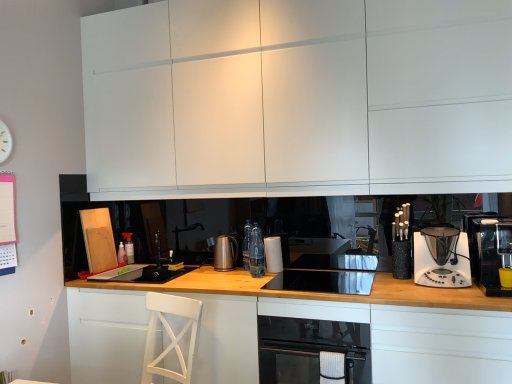
What do you see at coordinates (297, 98) in the screenshot?
I see `white matte cabinet at upper center, which is the first cabinetry in top-to-bottom order` at bounding box center [297, 98].

Locate an element on the screen. The height and width of the screenshot is (384, 512). white matte cabinet at upper center, which is the first cabinetry in top-to-bottom order is located at coordinates (297, 98).

Where is `black plastic coffee machine at right, which is the 3th kitchen appliance in left-to-right order`? The width and height of the screenshot is (512, 384). black plastic coffee machine at right, which is the 3th kitchen appliance in left-to-right order is located at coordinates (x=490, y=253).

Measure the distance between point (231, 268) and camera.

A distance of 2.86 meters exists between point (231, 268) and camera.

Identify the location of satin silver kettle at center, positioned as the 1th kitchen appliance in left-to-right order. (225, 253).

What is the approximate height of black glass oven at lower center?

black glass oven at lower center is 61.15 centimeters tall.

You are a GUI agent. You are given a task and a screenshot of the screen. Output one action in this format:
    pyautogui.click(x=<x>, y=<y>)
    Task: Click on the white matte cabinet at lower left, placed as the 2th cabinetry when sorted from bottom to top
    
    Given the screenshot: What is the action you would take?
    pyautogui.click(x=106, y=335)

In order to face white matte cabinet at lower left, positioned as the first cabinetry in bottom-to-top order, should I rotate leftwards or rightwards?

It's best to rotate right around 3.759 degrees.

This screenshot has height=384, width=512. In order to click on white matte cabinet at upper center, which is the first cabinetry in top-to-bottom order in this screenshot , I will do `click(297, 98)`.

Is white matte cabinet at lower left, which appears as the second cabinetry when viewed from the top, oriented towards satin silver kettle at center, which appears as the third kitchen appliance when viewed from the front?

No, white matte cabinet at lower left, which appears as the second cabinetry when viewed from the top, is not oriented towards satin silver kettle at center, which appears as the third kitchen appliance when viewed from the front.

In the scene shown: From a real-world perspective, which object stands above the other?

From a 3D spatial view, satin silver kettle at center, which appears as the third kitchen appliance when viewed from the front, is above.

From the image's perspective, is white matte cabinet at lower left, placed as the 2th cabinetry when sorted from bottom to top, above or below satin silver kettle at center, the first kitchen appliance positioned from the back?

white matte cabinet at lower left, placed as the 2th cabinetry when sorted from bottom to top, is below satin silver kettle at center, the first kitchen appliance positioned from the back.

Is satin silver kettle at center, positioned as the 1th kitchen appliance in left-to-right order, completely or partially inside white matte cabinet at lower left, which appears as the second cabinetry when viewed from the top?

No, satin silver kettle at center, positioned as the 1th kitchen appliance in left-to-right order, is not a part of white matte cabinet at lower left, which appears as the second cabinetry when viewed from the top.

From a real-world perspective, who is located higher, black glass oven at lower center or black plastic coffee machine at right, the 1th kitchen appliance from the front?

black plastic coffee machine at right, the 1th kitchen appliance from the front.

Considering their positions, is black glass oven at lower center located in front of or behind black plastic coffee machine at right, the 3th kitchen appliance when ordered from back to front?

black glass oven at lower center is positioned farther from the viewer than black plastic coffee machine at right, the 3th kitchen appliance when ordered from back to front.

Is black glass oven at lower center wider than black plastic coffee machine at right, the 3th kitchen appliance when ordered from back to front?

Indeed, black glass oven at lower center has a greater width compared to black plastic coffee machine at right, the 3th kitchen appliance when ordered from back to front.

Can you confirm if black glass oven at lower center is shorter than black plastic coffee machine at right, the 1th kitchen appliance from the front?

In fact, black glass oven at lower center may be taller than black plastic coffee machine at right, the 1th kitchen appliance from the front.

Between white plastic clock at upper left and black plastic coffee machine at right, which is the 3th kitchen appliance in left-to-right order, which one has less height?

With less height is white plastic clock at upper left.

Is white plastic clock at upper left facing away from black plastic coffee machine at right, which is the 3th kitchen appliance in left-to-right order?

That's not correct — white plastic clock at upper left is not looking away from black plastic coffee machine at right, which is the 3th kitchen appliance in left-to-right order.

Can you confirm if white plastic clock at upper left is thinner than black plastic coffee machine at right, the 1th kitchen appliance from the front?

Correct, the width of white plastic clock at upper left is less than that of black plastic coffee machine at right, the 1th kitchen appliance from the front.

Is white plastic clock at upper left beside black plastic coffee machine at right, the 3th kitchen appliance when ordered from back to front?

No, white plastic clock at upper left is not next to black plastic coffee machine at right, the 3th kitchen appliance when ordered from back to front.

Which of these two, black glass cooktop at center or white matte cabinet at lower left, which appears as the second cabinetry when viewed from the top, stands shorter?

black glass cooktop at center.

From the picture: How distant is black glass cooktop at center from white matte cabinet at lower left, placed as the 2th cabinetry when sorted from bottom to top?

black glass cooktop at center and white matte cabinet at lower left, placed as the 2th cabinetry when sorted from bottom to top, are 3.61 feet apart.

Is black glass cooktop at center outside of white matte cabinet at lower left, placed as the 2th cabinetry when sorted from bottom to top?

Absolutely, black glass cooktop at center is external to white matte cabinet at lower left, placed as the 2th cabinetry when sorted from bottom to top.

From the picture: Who is taller, black glass oven at lower center or white matte cabinet at lower left, the 3th cabinetry in the top-to-bottom sequence?

white matte cabinet at lower left, the 3th cabinetry in the top-to-bottom sequence, is taller.

The image size is (512, 384). Identify the location of home appliance above the white matte cabinet at lower left, the 3th cabinetry in the top-to-bottom sequence (from a real-world perspective). (311, 340).

How different are the orientations of black glass oven at lower center and white matte cabinet at lower left, positioned as the first cabinetry in bottom-to-top order, in degrees?

black glass oven at lower center and white matte cabinet at lower left, positioned as the first cabinetry in bottom-to-top order, are facing 3.88e-05 degrees away from each other.

Is black glass oven at lower center not within white matte cabinet at lower left, positioned as the first cabinetry in bottom-to-top order?

No, black glass oven at lower center is inside white matte cabinet at lower left, positioned as the first cabinetry in bottom-to-top order,'s boundary.

Would you say black glass oven at lower center is outside white plastic blender at right, acting as the 2th kitchen appliance starting from the right?

Yes, black glass oven at lower center is not within white plastic blender at right, acting as the 2th kitchen appliance starting from the right.

How different are the orientations of black glass oven at lower center and white plastic blender at right, acting as the 2th kitchen appliance starting from the right, in degrees?

They differ by 0.417 degrees in their facing directions.

Where is `home appliance below the white plastic blender at right, which is the second kitchen appliance from front to back (from a real-world perspective)`? This screenshot has height=384, width=512. home appliance below the white plastic blender at right, which is the second kitchen appliance from front to back (from a real-world perspective) is located at coordinates (311, 340).

Can you confirm if black glass oven at lower center is thinner than white plastic blender at right, the 2th kitchen appliance in the back-to-front sequence?

In fact, black glass oven at lower center might be wider than white plastic blender at right, the 2th kitchen appliance in the back-to-front sequence.

Which is in front, point (495, 230) or point (387, 328)?

The point (387, 328) is more forward.

From the image's perspective, does black plastic coffee machine at right, the 3th kitchen appliance when ordered from back to front, appear lower than white matte cabinet at lower left, positioned as the first cabinetry in bottom-to-top order?

Actually, black plastic coffee machine at right, the 3th kitchen appliance when ordered from back to front, appears above white matte cabinet at lower left, positioned as the first cabinetry in bottom-to-top order, in the image.

Can you confirm if black plastic coffee machine at right, which is the 3th kitchen appliance in left-to-right order, is wider than white matte cabinet at lower left, positioned as the first cabinetry in bottom-to-top order?

In fact, black plastic coffee machine at right, which is the 3th kitchen appliance in left-to-right order, might be narrower than white matte cabinet at lower left, positioned as the first cabinetry in bottom-to-top order.

From a real-world perspective, is black plastic coffee machine at right, which is the 3th kitchen appliance in left-to-right order, on top of white matte cabinet at lower left, positioned as the first cabinetry in bottom-to-top order?

Yes, from a real-world perspective, black plastic coffee machine at right, which is the 3th kitchen appliance in left-to-right order, is over white matte cabinet at lower left, positioned as the first cabinetry in bottom-to-top order

You are a GUI agent. You are given a task and a screenshot of the screen. Output one action in this format:
    pyautogui.click(x=<x>, y=<y>)
    Task: Click on the 3rd kitchen appliance behind the white matte cabinet at lower left, which appears as the second cabinetry when viewed from the top
    
    Given the screenshot: What is the action you would take?
    pyautogui.click(x=225, y=253)

Which kitchen appliance is the 2nd one when counting from the right side of the black glass oven at lower center? Please provide its 2D coordinates.

[(490, 253)]

When comparing their distances from black glass cooktop at center, does white plastic blender at right, acting as the 2th kitchen appliance starting from the right, or white matte cabinet at lower left, placed as the 2th cabinetry when sorted from bottom to top, seem closer?

white plastic blender at right, acting as the 2th kitchen appliance starting from the right.

Estimate the real-world distances between objects in this image. Which object is closer to satin silver kettle at center, the first kitchen appliance positioned from the back, black glass oven at lower center or white matte cabinet at lower left, which appears as the second cabinetry when viewed from the top?

white matte cabinet at lower left, which appears as the second cabinetry when viewed from the top, is closer to satin silver kettle at center, the first kitchen appliance positioned from the back.

When comparing their distances from white matte cabinet at lower left, positioned as the first cabinetry in bottom-to-top order, does black glass oven at lower center or black plastic coffee machine at right, which appears as the first kitchen appliance when viewed from the right, seem closer?

The object closer to white matte cabinet at lower left, positioned as the first cabinetry in bottom-to-top order, is black glass oven at lower center.

Estimate the real-world distances between objects in this image. Which object is closer to black plastic coffee machine at right, which is the 3th kitchen appliance in left-to-right order, white plastic clock at upper left or satin silver kettle at center, which appears as the third kitchen appliance when viewed from the front?

Among the two, satin silver kettle at center, which appears as the third kitchen appliance when viewed from the front, is located nearer to black plastic coffee machine at right, which is the 3th kitchen appliance in left-to-right order.

From the image, which object appears to be nearer to white plastic blender at right, acting as the 2th kitchen appliance starting from the left, satin silver kettle at center, the first kitchen appliance positioned from the back, or white matte cabinet at lower left, placed as the 2th cabinetry when sorted from bottom to top?

satin silver kettle at center, the first kitchen appliance positioned from the back, is positioned closer to the anchor white plastic blender at right, acting as the 2th kitchen appliance starting from the left.

Based on their spatial positions, is white matte cabinet at upper center, which is the first cabinetry in top-to-bottom order, or satin silver kettle at center, which is the third kitchen appliance in right-to-left order, further from black glass oven at lower center?

The object further to black glass oven at lower center is white matte cabinet at upper center, which is the first cabinetry in top-to-bottom order.

From the image, which object appears to be farther from white matte cabinet at upper center, which is the first cabinetry in top-to-bottom order, white matte cabinet at lower left, placed as the 2th cabinetry when sorted from bottom to top, or satin silver kettle at center, positioned as the 1th kitchen appliance in left-to-right order?

The object further to white matte cabinet at upper center, which is the first cabinetry in top-to-bottom order, is white matte cabinet at lower left, placed as the 2th cabinetry when sorted from bottom to top.

Based on the photo, based on their spatial positions, is black plastic coffee machine at right, which is the 3th kitchen appliance in left-to-right order, or white matte cabinet at lower left, positioned as the first cabinetry in bottom-to-top order, closer to satin silver kettle at center, which is the third kitchen appliance in right-to-left order?

white matte cabinet at lower left, positioned as the first cabinetry in bottom-to-top order, is closer to satin silver kettle at center, which is the third kitchen appliance in right-to-left order.

This screenshot has height=384, width=512. What are the coordinates of `home appliance between white matte cabinet at lower left, which appears as the second cabinetry when viewed from the top, and white plastic blender at right, acting as the 2th kitchen appliance starting from the left` in the screenshot? It's located at (311, 340).

Locate an element on the screen. This screenshot has height=384, width=512. cabinetry between white matte cabinet at upper center, positioned as the 3th cabinetry in bottom-to-top order, and black glass oven at lower center, in the vertical direction is located at coordinates (106, 335).

In order to click on cabinetry that lies between white matte cabinet at upper center, positioned as the 3th cabinetry in bottom-to-top order, and white matte cabinet at lower left, positioned as the first cabinetry in bottom-to-top order, from top to bottom in this screenshot , I will do `click(106, 335)`.

Identify the location of cabinetry situated between white plastic clock at upper left and white matte cabinet at lower left, positioned as the first cabinetry in bottom-to-top order, from left to right. [106, 335].